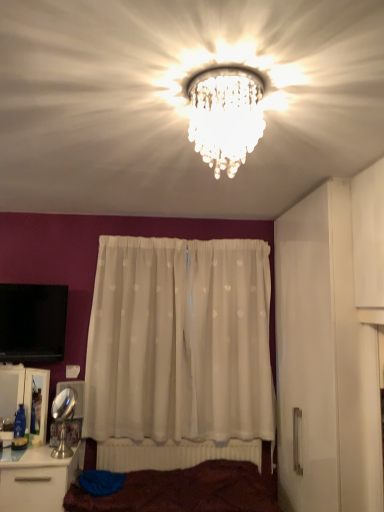
Question: Is white glossy cabinet at lower left to the left of brown fabric bed at lower center from the viewer's perspective?

Choices:
 (A) no
 (B) yes

Answer: (B)

Question: Is white glossy cabinet at lower left looking in the opposite direction of brown fabric bed at lower center?

Choices:
 (A) yes
 (B) no

Answer: (B)

Question: From a real-world perspective, is white glossy cabinet at lower left under brown fabric bed at lower center?

Choices:
 (A) yes
 (B) no

Answer: (B)

Question: Is brown fabric bed at lower center surrounded by white glossy cabinet at lower left?

Choices:
 (A) yes
 (B) no

Answer: (B)

Question: Does white glossy cabinet at lower left turn towards brown fabric bed at lower center?

Choices:
 (A) no
 (B) yes

Answer: (A)

Question: Considering the relative sizes of white glossy cabinet at lower left and brown fabric bed at lower center in the image provided, is white glossy cabinet at lower left bigger than brown fabric bed at lower center?

Choices:
 (A) yes
 (B) no

Answer: (B)

Question: Does white sheer curtain at center have a lesser width compared to white plastic radiator at lower center?

Choices:
 (A) yes
 (B) no

Answer: (B)

Question: Are white sheer curtain at center and white plastic radiator at lower center beside each other?

Choices:
 (A) no
 (B) yes

Answer: (A)

Question: Is white sheer curtain at center to the left of white plastic radiator at lower center from the viewer's perspective?

Choices:
 (A) yes
 (B) no

Answer: (A)

Question: Is white sheer curtain at center further to camera compared to white plastic radiator at lower center?

Choices:
 (A) no
 (B) yes

Answer: (A)

Question: Would you say white sheer curtain at center is outside white plastic radiator at lower center?

Choices:
 (A) yes
 (B) no

Answer: (A)

Question: Does white sheer curtain at center have a greater height compared to white plastic radiator at lower center?

Choices:
 (A) no
 (B) yes

Answer: (B)

Question: Is brown fabric bed at lower center turned away from clear crystal chandelier at center?

Choices:
 (A) yes
 (B) no

Answer: (B)